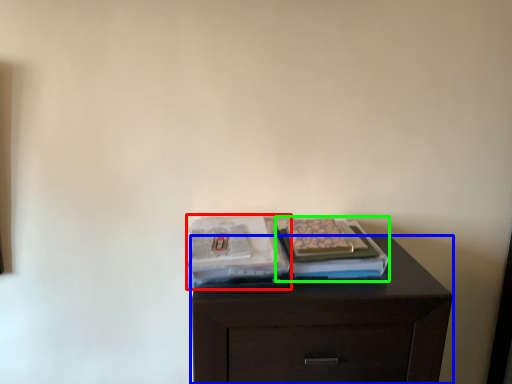
Question: Which object is positioned closest to magazine (highlighted by a red box)? Select from chest of drawers (highlighted by a blue box) and magazine (highlighted by a green box).

Choices:
 (A) chest of drawers
 (B) magazine

Answer: (B)